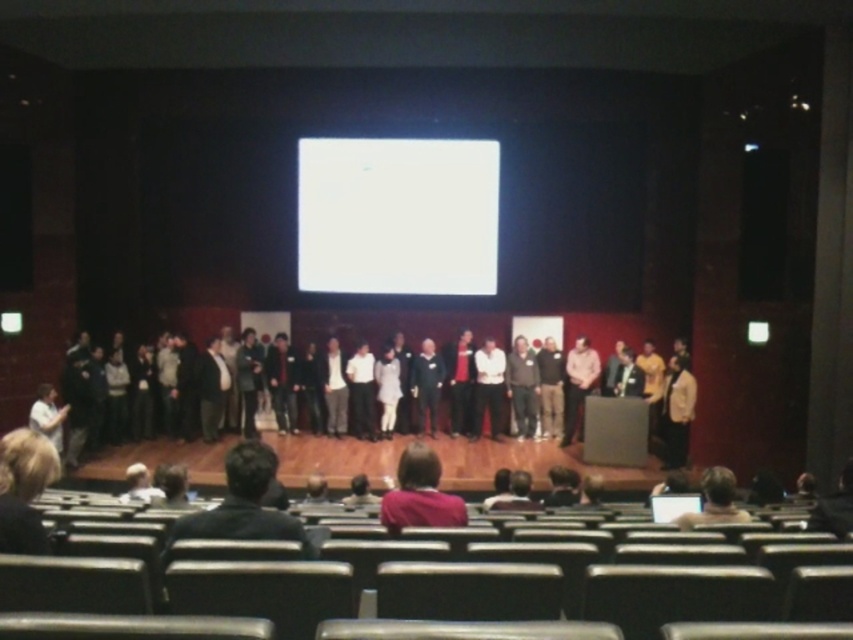
Between white glossy projection screen at center and purple sweater at center, which one appears on the left side from the viewer's perspective?

Positioned to the left is white glossy projection screen at center.

Can you confirm if white glossy projection screen at center is wider than purple sweater at center?

Correct, the width of white glossy projection screen at center exceeds that of purple sweater at center.

Which is behind, point (318, 244) or point (456, 497)?

The point (318, 244) is more distant.

I want to click on white glossy projection screen at center, so (x=397, y=216).

Is dark gray sweater at center to the left of dark brown leather jacket at lower center from the viewer's perspective?

Indeed, dark gray sweater at center is positioned on the left side of dark brown leather jacket at lower center.

Locate an element on the screen. The width and height of the screenshot is (853, 640). dark gray sweater at center is located at coordinates (242, 504).

Does blonde hair at lower left have a lesser height compared to purple sweater at center?

Yes, blonde hair at lower left is shorter than purple sweater at center.

Between blonde hair at lower left and purple sweater at center, which one appears on the left side from the viewer's perspective?

From the viewer's perspective, blonde hair at lower left appears more on the left side.

This screenshot has width=853, height=640. I want to click on blonde hair at lower left, so click(x=24, y=490).

The width and height of the screenshot is (853, 640). Identify the location of blonde hair at lower left. point(24,490).